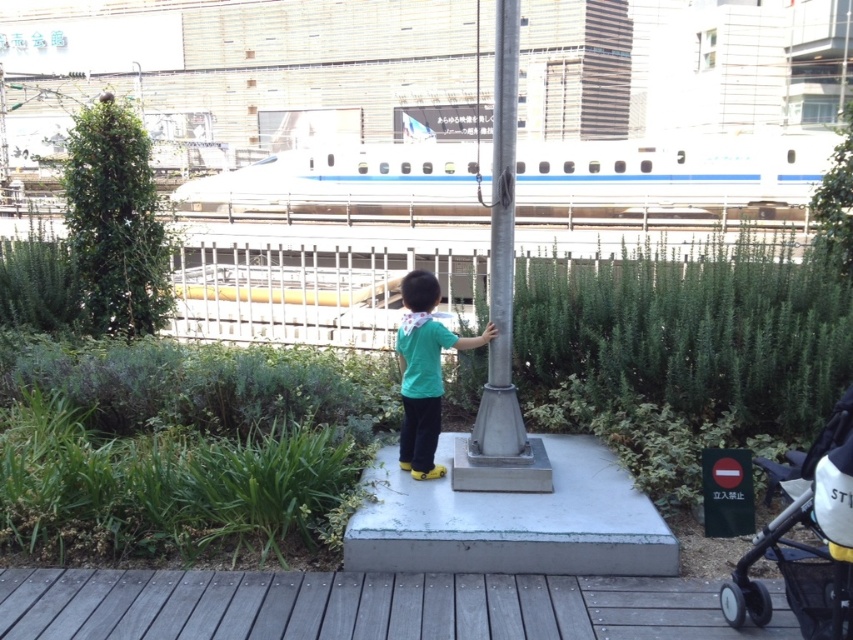
Is white plastic baby carriage at lower right below metallic gray pole at center?

Yes.

Can you confirm if white plastic baby carriage at lower right is positioned to the left of metallic gray pole at center?

No, white plastic baby carriage at lower right is not to the left of metallic gray pole at center.

Between point (821, 593) and point (509, 16), which one is positioned behind?

Positioned behind is point (509, 16).

Image resolution: width=853 pixels, height=640 pixels. Find the location of `white plastic baby carriage at lower right`. white plastic baby carriage at lower right is located at coordinates click(799, 547).

Is point (834, 570) more distant than point (426, 449)?

No, it is in front of (426, 449).

How distant is white plastic baby carriage at lower right from green matte shirt at center?

white plastic baby carriage at lower right and green matte shirt at center are 5.73 feet apart.

Identify the location of white plastic baby carriage at lower right. The image size is (853, 640). [x=799, y=547].

Is point (506, 396) in front of point (428, 420)?

Yes.

Can you confirm if metallic gray pole at center is wider than green matte shirt at center?

Incorrect, metallic gray pole at center's width does not surpass green matte shirt at center's.

Is point (503, 132) positioned in front of point (439, 380)?

That is True.

Locate an element on the screen. The width and height of the screenshot is (853, 640). metallic gray pole at center is located at coordinates (502, 260).